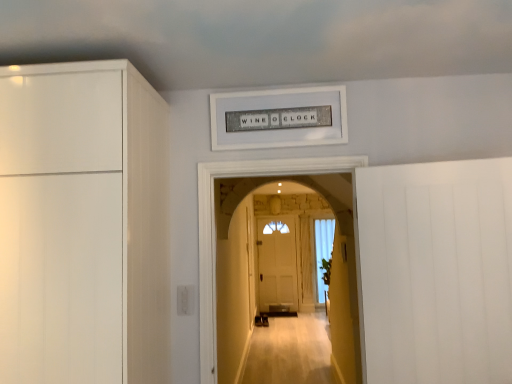
Locate an element on the screen. The height and width of the screenshot is (384, 512). white matte door at right is located at coordinates (436, 271).

Describe the element at coordinates (323, 252) in the screenshot. I see `white sheer curtain at center` at that location.

Locate an element on the screen. white textured sign at upper center is located at coordinates (279, 118).

Where is `white matte door at right`? The height and width of the screenshot is (384, 512). white matte door at right is located at coordinates (436, 271).

Is the surface of smooth beige carpet at center in direct contact with white matte door at right?

No, smooth beige carpet at center is not beside white matte door at right.

Does smooth beige carpet at center have a lesser width compared to white matte door at right?

In fact, smooth beige carpet at center might be wider than white matte door at right.

Is smooth beige carpet at center not within white matte door at right?

Indeed, smooth beige carpet at center is completely outside white matte door at right.

Considering the positions of points (291, 160) and (390, 194), is point (291, 160) farther from camera compared to point (390, 194)?

Yes.

Does white matte door at right turn towards white sheer curtain at center?

No.

Does point (406, 223) appear closer or farther from the camera than point (321, 234)?

Clearly, point (406, 223) is closer to the camera than point (321, 234).

From a real-world perspective, is white matte door at right positioned above or below white sheer curtain at center?

Clearly, from a real-world perspective, white matte door at right is above white sheer curtain at center.

Considering the relative positions of white matte door at right and white sheer curtain at center in the image provided, is white matte door at right to the right of white sheer curtain at center from the viewer's perspective?

Incorrect, white matte door at right is not on the right side of white sheer curtain at center.

Considering the relative positions of smooth beige carpet at center and white textured sign at upper center in the image provided, is smooth beige carpet at center to the left of white textured sign at upper center from the viewer's perspective?

No, smooth beige carpet at center is not to the left of white textured sign at upper center.

Is smooth beige carpet at center wider or thinner than white textured sign at upper center?

Clearly, smooth beige carpet at center has more width compared to white textured sign at upper center.

Is smooth beige carpet at center beside white textured sign at upper center?

smooth beige carpet at center is not next to white textured sign at upper center, and they're not touching.

Which object is thinner, white matte door at right or smooth beige carpet at center?

white matte door at right.

Between point (492, 310) and point (202, 246), which one is positioned behind?

The point (202, 246) is behind.

Who is shorter, white matte door at right or smooth beige carpet at center?

Standing shorter between the two is white matte door at right.

From a real-world perspective, between white matte door at right and smooth beige carpet at center, who is vertically higher?

From a 3D spatial view, smooth beige carpet at center is above.

Between white glossy cabinet at left and white textured sign at upper center, which one appears on the right side from the viewer's perspective?

white textured sign at upper center is more to the right.

Is white glossy cabinet at left not close to white textured sign at upper center?

No, white glossy cabinet at left is not far from white textured sign at upper center.

From the picture: Which is closer, (63, 301) or (228, 136)?

The point (63, 301) is more forward.

Does white textured sign at upper center have a smaller size compared to white matte door at right?

Yes, white textured sign at upper center is smaller than white matte door at right.

Could you tell me if white textured sign at upper center is facing white matte door at right?

No, white textured sign at upper center does not turn towards white matte door at right.

Is white textured sign at upper center taller than white matte door at right?

Incorrect, the height of white textured sign at upper center is not larger of that of white matte door at right.

The image size is (512, 384). Identify the location of picture frame located above the white matte door at right (from a real-world perspective). (279, 118).

Which is closer to the camera, (460, 206) or (220, 133)?

Point (460, 206) is positioned closer to the camera compared to point (220, 133).

Between white matte door at right and white textured sign at upper center, which one has smaller width?

white textured sign at upper center.

Is white matte door at right taller than white textured sign at upper center?

Indeed, white matte door at right has a greater height compared to white textured sign at upper center.

From a real-world perspective, is white matte door at right positioned over white textured sign at upper center based on gravity?

No, from a real-world perspective, white matte door at right is not above white textured sign at upper center.

Where is `corridor on the left of the white matte door at right`? This screenshot has width=512, height=384. corridor on the left of the white matte door at right is located at coordinates (215, 231).

This screenshot has width=512, height=384. I want to click on door above the white sheer curtain at center (from the image's perspective), so click(436, 271).

Estimate the real-world distances between objects in this image. Which object is closer to white sheer curtain at center, white matte door at right or white textured sign at upper center?

white matte door at right.

From the picture: Which object lies further to the anchor point white matte door at right, white textured sign at upper center or white glossy cabinet at left?

Among the two, white glossy cabinet at left is located further to white matte door at right.

From the image, which object appears to be farther from white textured sign at upper center, white glossy cabinet at left or smooth beige carpet at center?

Among the two, white glossy cabinet at left is located further to white textured sign at upper center.

Looking at the image, which one is located closer to white sheer curtain at center, white textured sign at upper center or white matte door at right?

white matte door at right lies closer to white sheer curtain at center than the other object.

Which object lies further to the anchor point smooth beige carpet at center, white sheer curtain at center or white textured sign at upper center?

Among the two, white sheer curtain at center is located further to smooth beige carpet at center.

Looking at the image, which one is located further to white textured sign at upper center, white sheer curtain at center or white matte door at right?

white sheer curtain at center lies further to white textured sign at upper center than the other object.

Which object lies further to the anchor point white textured sign at upper center, smooth beige carpet at center or white glossy cabinet at left?

white glossy cabinet at left is further to white textured sign at upper center.

When comparing their distances from white textured sign at upper center, does smooth beige carpet at center or white sheer curtain at center seem further?

white sheer curtain at center lies further to white textured sign at upper center than the other object.

Identify the location of picture frame between white glossy cabinet at left and smooth beige carpet at center from left to right. The width and height of the screenshot is (512, 384). point(279,118).

Where is `corridor located between white glossy cabinet at left and white sheer curtain at center in the depth direction`? The image size is (512, 384). corridor located between white glossy cabinet at left and white sheer curtain at center in the depth direction is located at coordinates (215, 231).

In order to click on door between white textured sign at upper center and smooth beige carpet at center in the up-down direction in this screenshot , I will do `click(436, 271)`.

Where is `picture frame between white matte door at right and white sheer curtain at center along the z-axis`? The width and height of the screenshot is (512, 384). picture frame between white matte door at right and white sheer curtain at center along the z-axis is located at coordinates (279, 118).